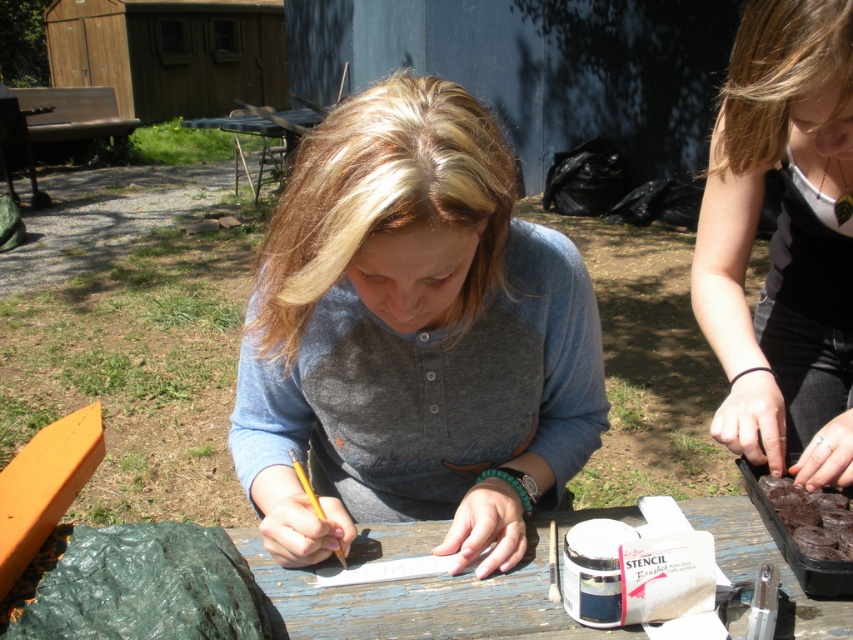
Question: Which point appears closest to the camera in this image?

Choices:
 (A) (851, 188)
 (B) (424, 616)
 (C) (468, 99)
 (D) (817, 522)

Answer: (C)

Question: Is matte black shirt at upper right thinner than dark chocolate cake at lower right?

Choices:
 (A) no
 (B) yes

Answer: (A)

Question: Which point is farther from the camera taking this photo?

Choices:
 (A) (844, 508)
 (B) (440, 452)

Answer: (B)

Question: Does wooden table at center appear under dark chocolate cake at lower right?

Choices:
 (A) no
 (B) yes

Answer: (B)

Question: Among these points, which one is nearest to the camera?

Choices:
 (A) (846, 148)
 (B) (302, 289)
 (C) (804, 492)

Answer: (B)

Question: Does matte black shirt at upper right have a larger size compared to wooden table at center?

Choices:
 (A) no
 (B) yes

Answer: (B)